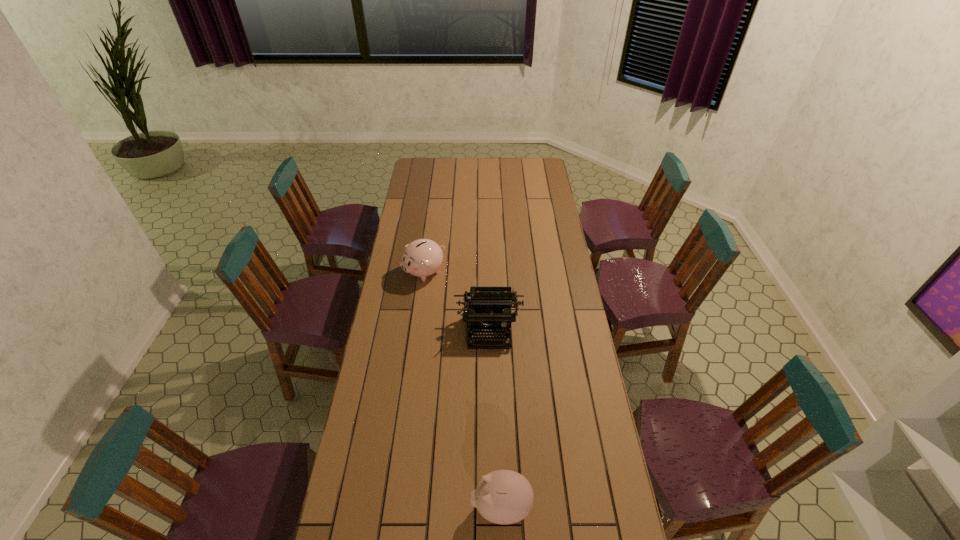
Locate an element on the screen. object located in the left edge section of the desktop is located at coordinates (423, 257).

Identify the location of blank space at the far edge of the desktop. (517, 169).

Image resolution: width=960 pixels, height=540 pixels. Identify the location of vacant space at the left edge of the desktop. (394, 284).

The width and height of the screenshot is (960, 540). In the image, there is a desktop. Identify the location of vacant space at the right edge. (574, 354).

Identify the location of blank space at the far right corner of the desktop. (527, 166).

Where is `free space between the right piggy bank and the farther piggy bank`? This screenshot has width=960, height=540. free space between the right piggy bank and the farther piggy bank is located at coordinates (463, 389).

This screenshot has height=540, width=960. What are the coordinates of `vacant area that lies between the right piggy bank and the farther piggy bank` in the screenshot? It's located at (463, 389).

In order to click on vacant space in between the farthest object and the second nearest object in this screenshot , I will do `click(457, 301)`.

At what (x,y) coordinates should I click in order to perform the action: click on free point between the shorter piggy bank and the farther piggy bank. Please return your answer as a coordinate pair (x, y). Looking at the image, I should click on (463, 389).

Find the location of a particular element. The image size is (960, 540). free space between the right piggy bank and the typewriter is located at coordinates [x=494, y=418].